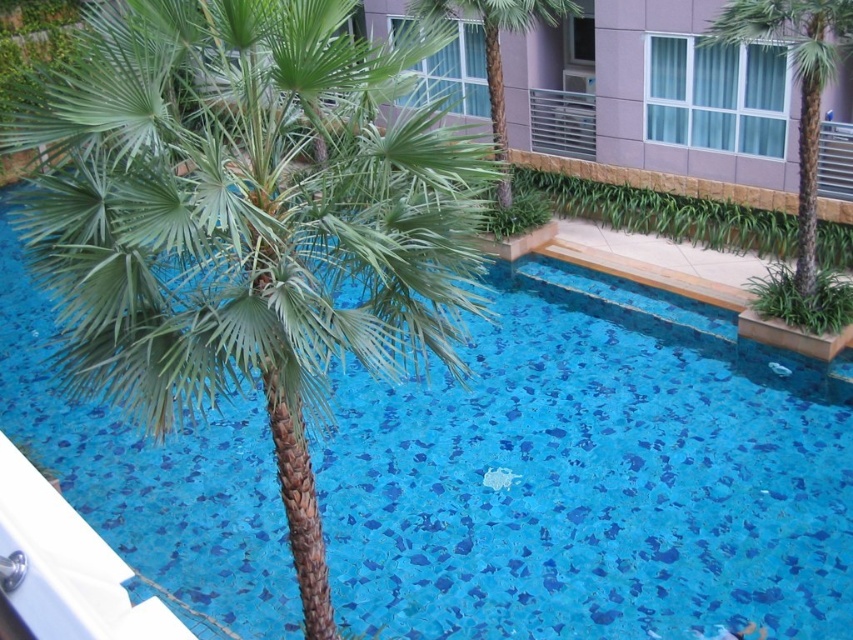
Between blue mosaic tiles at center and green leafy palm tree at right, which one appears on the left side from the viewer's perspective?

blue mosaic tiles at center is more to the left.

Can you confirm if blue mosaic tiles at center is positioned below green leafy palm tree at right?

Indeed, blue mosaic tiles at center is positioned under green leafy palm tree at right.

Which is in front, point (706, 564) or point (802, 74)?

Point (706, 564)

This screenshot has width=853, height=640. What are the coordinates of `blue mosaic tiles at center` in the screenshot? It's located at click(x=584, y=492).

Can you confirm if green leafy palm tree at right is shorter than green leafy palm tree at center?

No.

In the scene shown: Between green leafy palm tree at right and green leafy palm tree at center, which one has less height?

Standing shorter between the two is green leafy palm tree at center.

Locate an element on the screen. Image resolution: width=853 pixels, height=640 pixels. green leafy palm tree at right is located at coordinates (799, 83).

Which is below, blue mosaic tiles at center or green leafy palm tree at left?

blue mosaic tiles at center

Who is positioned more to the left, blue mosaic tiles at center or green leafy palm tree at left?

Positioned to the left is blue mosaic tiles at center.

The width and height of the screenshot is (853, 640). In order to click on blue mosaic tiles at center in this screenshot , I will do `click(584, 492)`.